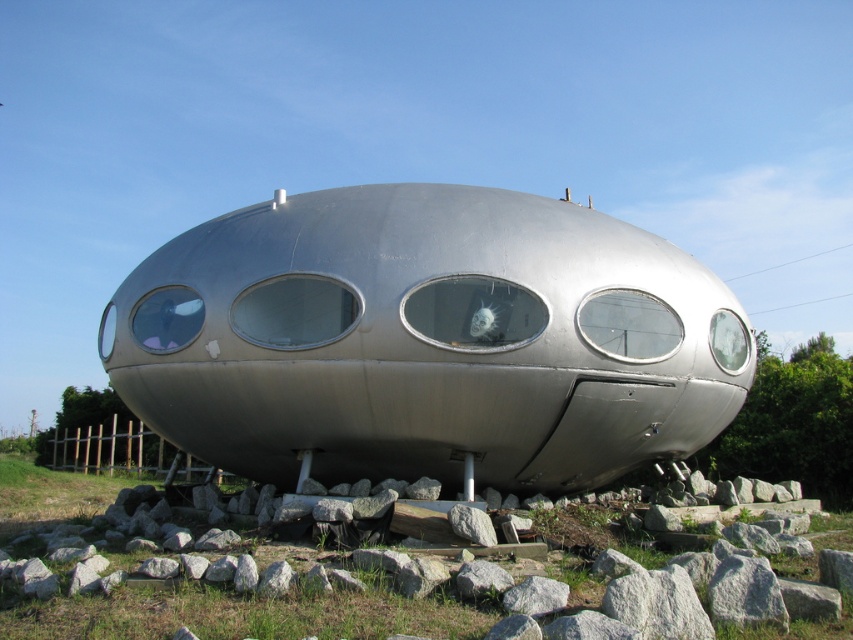
Question: Among these points, which one is nearest to the camera?

Choices:
 (A) (56, 516)
 (B) (462, 564)
 (C) (405, 225)

Answer: (B)

Question: Which point is farther from the camera taking this photo?

Choices:
 (A) (564, 586)
 (B) (665, 348)

Answer: (B)

Question: Is gray rough rock at center above gray rough stone at center?

Choices:
 (A) no
 (B) yes

Answer: (A)

Question: Does gray rough rock at center have a lesser width compared to gray rock at center?

Choices:
 (A) no
 (B) yes

Answer: (A)

Question: From the image, what is the correct spatial relationship of gray rock at lower center in relation to gray rough rock at center?

Choices:
 (A) left
 (B) right

Answer: (A)

Question: Estimate the real-world distances between objects in this image. Which object is farther from the gray rock at lower center?

Choices:
 (A) gray rough rock at center
 (B) gray rough stone at center
 (C) metallic silver dome at center

Answer: (C)